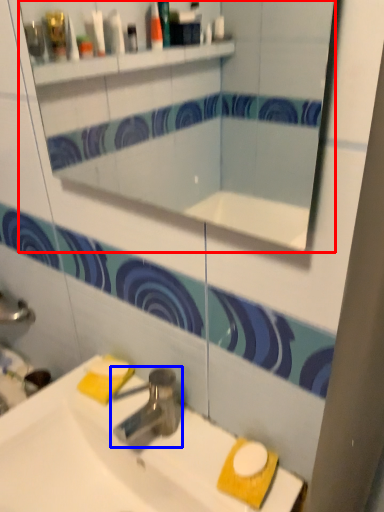
Question: Which object appears closest to the camera in this image, mirror (highlighted by a red box) or tap (highlighted by a blue box)?

Choices:
 (A) mirror
 (B) tap

Answer: (A)